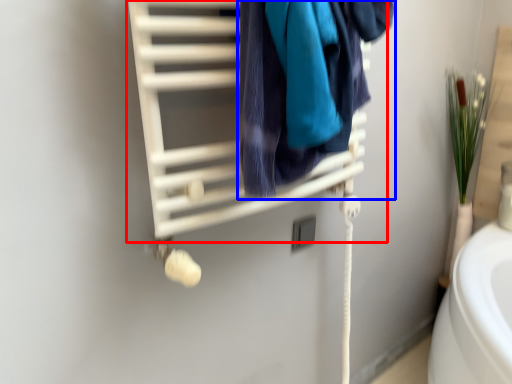
Question: Which object is further to the camera taking this photo, closet (highlighted by a red box) or towel (highlighted by a blue box)?

Choices:
 (A) closet
 (B) towel

Answer: (B)